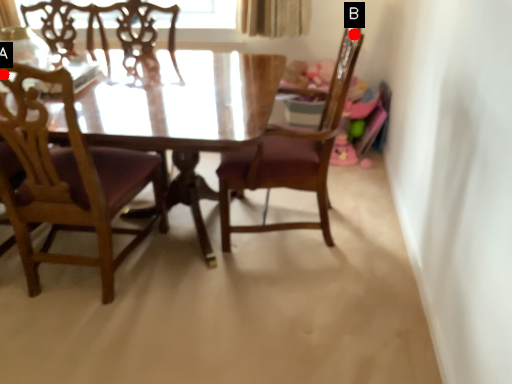
Question: Two points are circled on the image, labeled by A and B beside each circle. Among these points, which one is nearest to the camera?

Choices:
 (A) A is closer
 (B) B is closer

Answer: (A)